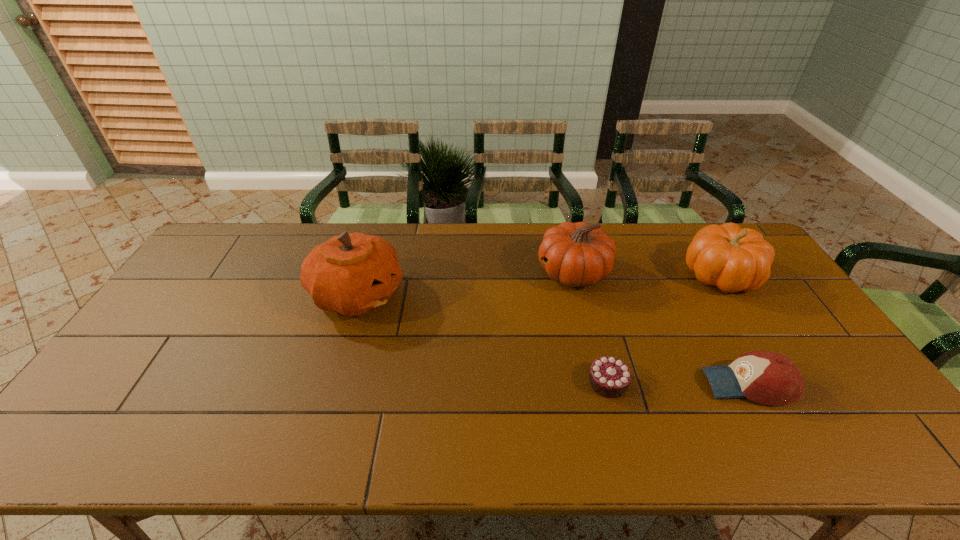
Find the location of a particular element. The image size is (960, 540). free location located 0.210m on the front of the rightmost pumpkin is located at coordinates (772, 355).

The width and height of the screenshot is (960, 540). Identify the location of vacant area situated on the front-facing side of the baseball cap. (641, 384).

Where is `vacant space located on the front-facing side of the baseball cap`? The height and width of the screenshot is (540, 960). vacant space located on the front-facing side of the baseball cap is located at coordinates (661, 384).

At what (x,y) coordinates should I click in order to perform the action: click on vacant position located 0.050m on the front-facing side of the baseball cap. Please return your answer as a coordinate pair (x, y). The width and height of the screenshot is (960, 540). Looking at the image, I should click on coord(685,384).

I want to click on free space located on the right of the shortest object, so click(671, 382).

Where is `object at the right edge`? This screenshot has width=960, height=540. object at the right edge is located at coordinates [732, 258].

Where is `object that is at the far right corner`? object that is at the far right corner is located at coordinates (732, 258).

This screenshot has width=960, height=540. Find the location of `vacant point at the far edge`. vacant point at the far edge is located at coordinates (651, 255).

Find the location of `vacant space at the near edge of the desktop`. vacant space at the near edge of the desktop is located at coordinates (382, 441).

In the image, there is a desktop. Where is `vacant area at the left edge`? The height and width of the screenshot is (540, 960). vacant area at the left edge is located at coordinates (202, 327).